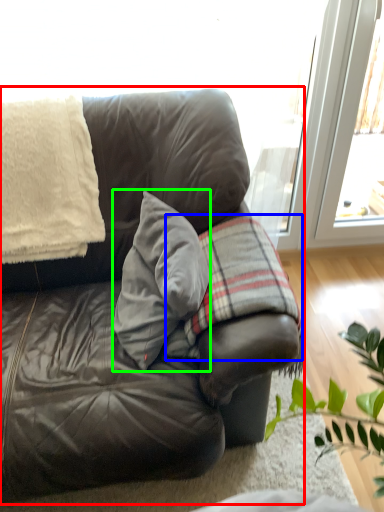
Question: Estimate the real-world distances between objects in this image. Which object is closer to studio couch (highlighted by a red box), plaid (highlighted by a blue box) or throw pillow (highlighted by a green box)?

Choices:
 (A) plaid
 (B) throw pillow

Answer: (B)